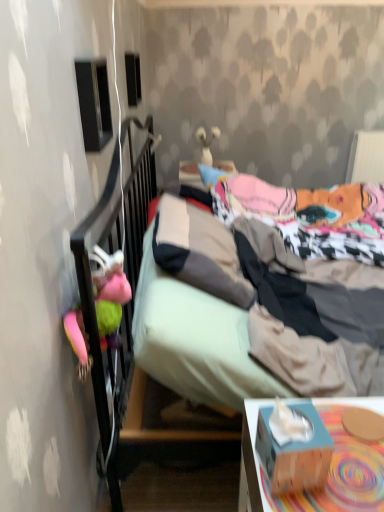
Question: From the image's perspective, is white glossy vase at upper center, arranged as the second toy when viewed from the front, on top of wooden tissue box at lower right?

Choices:
 (A) no
 (B) yes

Answer: (B)

Question: From the image's perspective, is white glossy vase at upper center, the first toy positioned from the back, located beneath wooden tissue box at lower right?

Choices:
 (A) yes
 (B) no

Answer: (B)

Question: Is white glossy vase at upper center, which is the 2th toy from left to right, positioned far away from wooden tissue box at lower right?

Choices:
 (A) yes
 (B) no

Answer: (A)

Question: Is white glossy vase at upper center, which is counted as the first toy, starting from the top, bigger than wooden tissue box at lower right?

Choices:
 (A) yes
 (B) no

Answer: (B)

Question: Does white glossy vase at upper center, arranged as the second toy when viewed from the front, have a lesser height compared to wooden tissue box at lower right?

Choices:
 (A) yes
 (B) no

Answer: (A)

Question: Is wooden tissue box at lower right a part of white glossy vase at upper center, the second toy when ordered from bottom to top?

Choices:
 (A) yes
 (B) no

Answer: (B)

Question: Considering the relative sizes of blue cardboard tissue box at lower right and white glossy vase at upper center, acting as the first toy starting from the right, in the image provided, is blue cardboard tissue box at lower right shorter than white glossy vase at upper center, acting as the first toy starting from the right,?

Choices:
 (A) yes
 (B) no

Answer: (A)

Question: From a real-world perspective, is blue cardboard tissue box at lower right beneath white glossy vase at upper center, arranged as the second toy when viewed from the front?

Choices:
 (A) no
 (B) yes

Answer: (B)

Question: Is blue cardboard tissue box at lower right in front of white glossy vase at upper center, which is the 2th toy from left to right?

Choices:
 (A) no
 (B) yes

Answer: (B)

Question: Is blue cardboard tissue box at lower right positioned beyond the bounds of white glossy vase at upper center, arranged as the second toy when viewed from the front?

Choices:
 (A) no
 (B) yes

Answer: (B)

Question: From the image's perspective, is blue cardboard tissue box at lower right on top of white glossy vase at upper center, the second toy when ordered from bottom to top?

Choices:
 (A) yes
 (B) no

Answer: (B)

Question: Does blue cardboard tissue box at lower right have a lesser width compared to white glossy vase at upper center, arranged as the second toy when viewed from the front?

Choices:
 (A) no
 (B) yes

Answer: (B)

Question: Can you confirm if black matte speaker at upper left, marked as the first loudspeaker in a front-to-back arrangement, is smaller than blue cardboard tissue box at lower right?

Choices:
 (A) yes
 (B) no

Answer: (B)